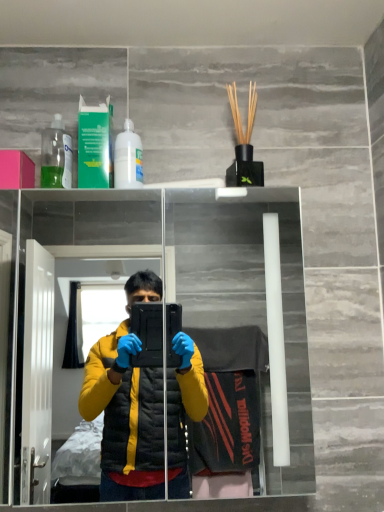
Question: Can you confirm if green plastic mouthwash at upper left is smaller than transparent glass mirror at upper center?

Choices:
 (A) no
 (B) yes

Answer: (B)

Question: Is green plastic mouthwash at upper left at the right side of transparent glass mirror at upper center?

Choices:
 (A) no
 (B) yes

Answer: (A)

Question: Is green plastic mouthwash at upper left bigger than transparent glass mirror at upper center?

Choices:
 (A) yes
 (B) no

Answer: (B)

Question: From a real-world perspective, does green plastic mouthwash at upper left sit lower than transparent glass mirror at upper center?

Choices:
 (A) yes
 (B) no

Answer: (B)

Question: Is green plastic mouthwash at upper left not near transparent glass mirror at upper center?

Choices:
 (A) no
 (B) yes

Answer: (B)

Question: Is transparent plastic bottle at upper left, placed as the first bottle when sorted from left to right, situated inside green plastic mouthwash at upper left or outside?

Choices:
 (A) inside
 (B) outside

Answer: (B)

Question: Considering the positions of transparent plastic bottle at upper left, the second bottle viewed from the right, and green plastic mouthwash at upper left in the image, is transparent plastic bottle at upper left, the second bottle viewed from the right, wider or thinner than green plastic mouthwash at upper left?

Choices:
 (A) wide
 (B) thin

Answer: (B)

Question: In terms of height, does transparent plastic bottle at upper left, placed as the first bottle when sorted from left to right, look taller or shorter compared to green plastic mouthwash at upper left?

Choices:
 (A) short
 (B) tall

Answer: (A)

Question: Would you say transparent plastic bottle at upper left, placed as the first bottle when sorted from left to right, is to the left or to the right of green plastic mouthwash at upper left in the picture?

Choices:
 (A) left
 (B) right

Answer: (A)

Question: In terms of size, does pink matte box at upper left appear bigger or smaller than white glossy bottle at upper center, the second bottle positioned from the left?

Choices:
 (A) small
 (B) big

Answer: (B)

Question: Considering their positions, is pink matte box at upper left located in front of or behind white glossy bottle at upper center, the first bottle viewed from the right?

Choices:
 (A) front
 (B) behind

Answer: (B)

Question: From the image's perspective, is pink matte box at upper left above or below white glossy bottle at upper center, the second bottle positioned from the left?

Choices:
 (A) above
 (B) below

Answer: (B)

Question: Choose the correct answer: Is pink matte box at upper left inside white glossy bottle at upper center, the first bottle viewed from the right, or outside it?

Choices:
 (A) inside
 (B) outside

Answer: (B)

Question: Is point (304, 358) positioned closer to the camera than point (56, 120)?

Choices:
 (A) closer
 (B) farther

Answer: (B)

Question: Is transparent glass mirror at upper center in front of or behind transparent plastic bottle at upper left, the second bottle viewed from the right, in the image?

Choices:
 (A) behind
 (B) front

Answer: (B)